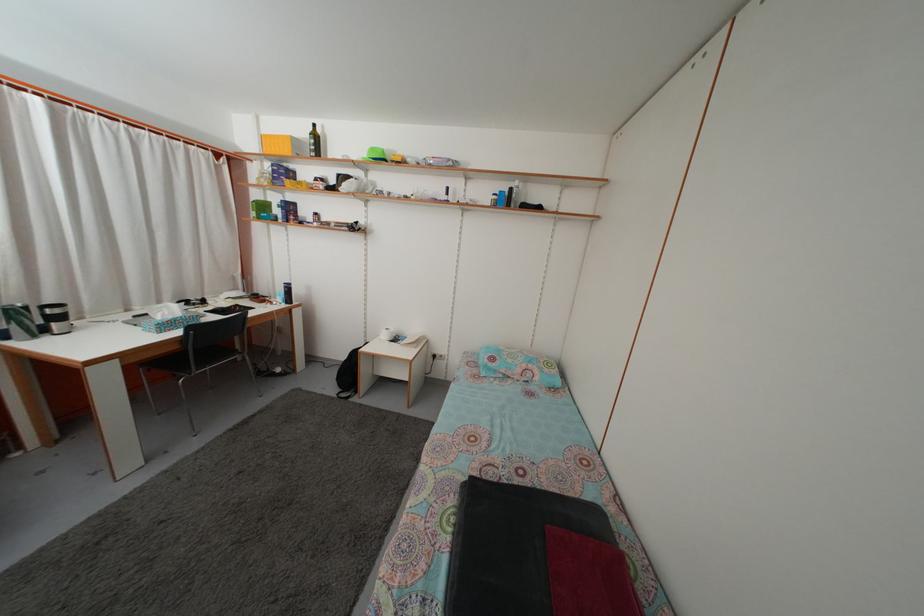
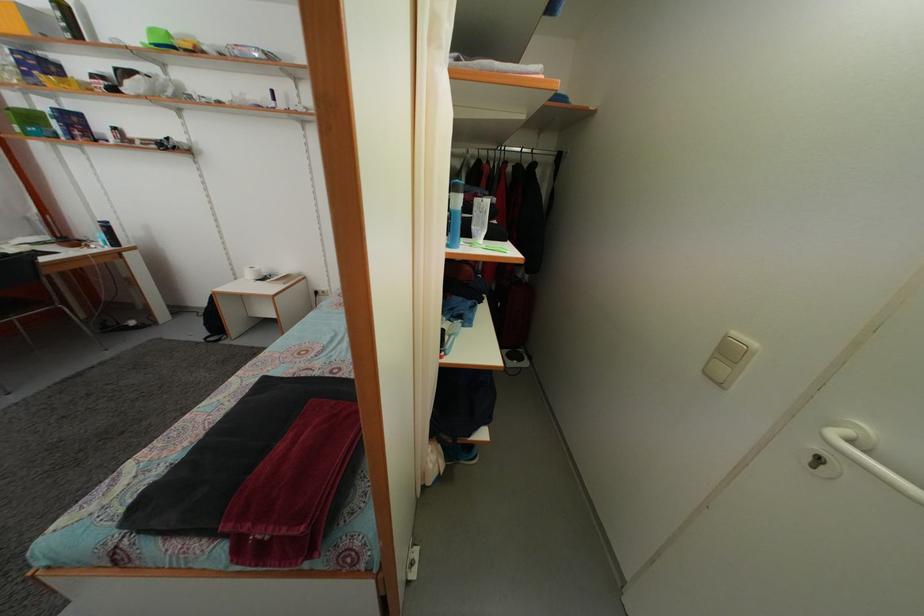
Question: The first image is from the beginning of the video and the second image is from the end. How did the camera likely rotate when shooting the video?

Choices:
 (A) Left
 (B) Right
 (C) Up
 (D) Down

Answer: (D)